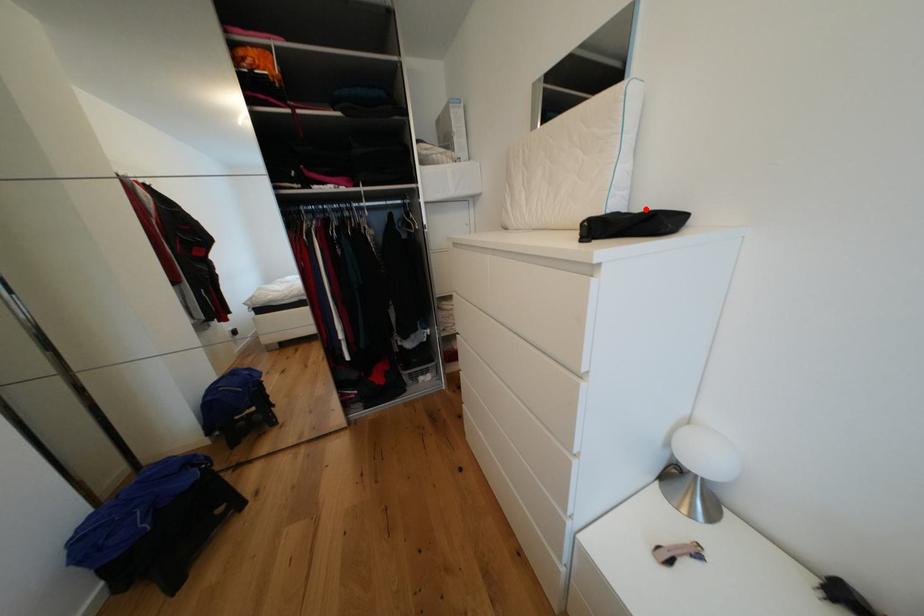
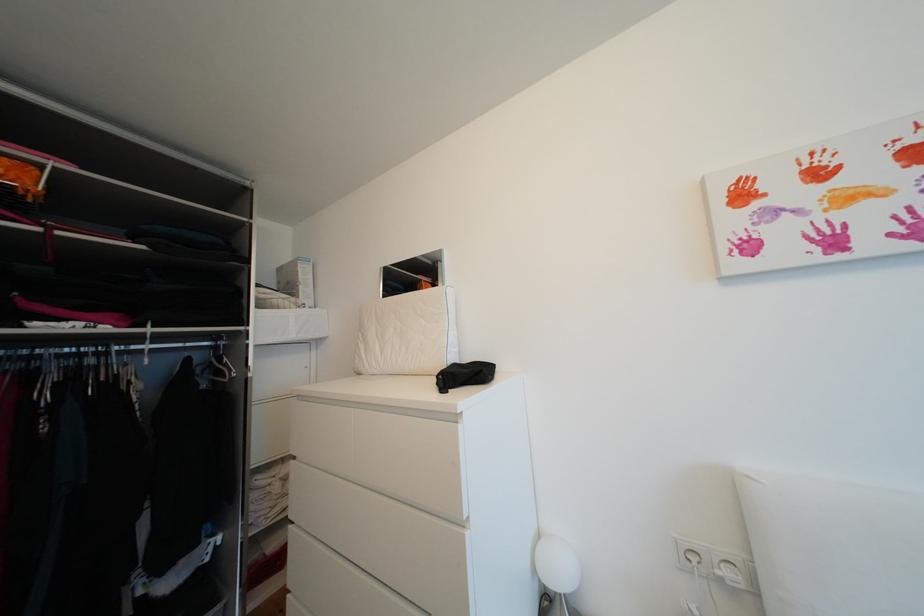
Find the pixel in the second image that matches the highlighted location in the first image.

(473, 362)